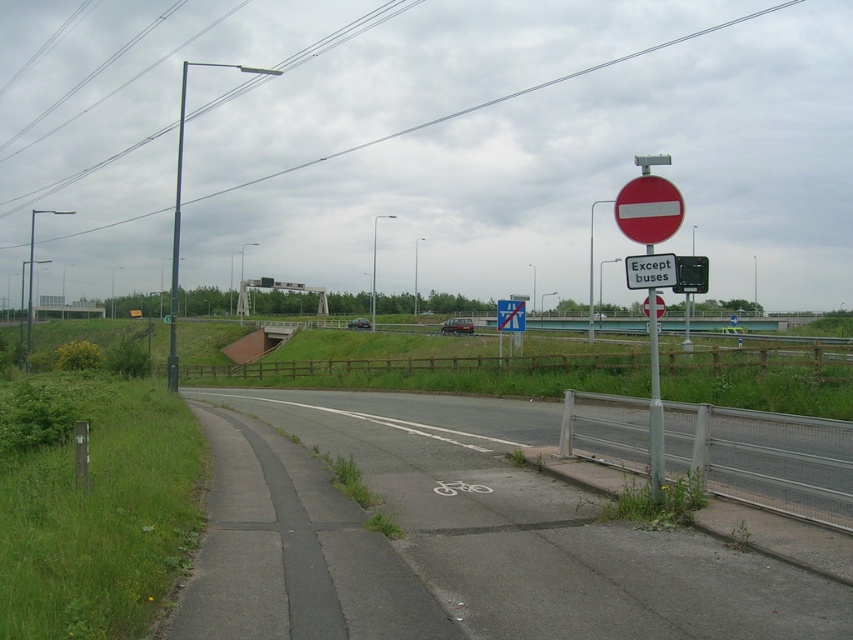
The image size is (853, 640). I want to click on asphalt road at lower left, so click(465, 536).

Which is more to the left, asphalt road at lower left or red matte stop sign at upper right?

From the viewer's perspective, asphalt road at lower left appears more on the left side.

The image size is (853, 640). I want to click on asphalt road at lower left, so click(465, 536).

The height and width of the screenshot is (640, 853). What are the coordinates of `asphalt road at lower left` in the screenshot? It's located at (465, 536).

Is asphalt road at lower left above red matte sign at upper right?

No, asphalt road at lower left is not above red matte sign at upper right.

Can you confirm if asphalt road at lower left is positioned below red matte sign at upper right?

Yes, asphalt road at lower left is below red matte sign at upper right.

Is point (413, 504) positioned before point (619, 218)?

No, it is behind (619, 218).

What are the coordinates of `asphalt road at lower left` in the screenshot? It's located at (465, 536).

Can you confirm if metallic pole at upper right is thinner than red matte stop sign at upper right?

In fact, metallic pole at upper right might be wider than red matte stop sign at upper right.

Who is higher up, metallic pole at upper right or red matte stop sign at upper right?

metallic pole at upper right is higher up.

This screenshot has width=853, height=640. Describe the element at coordinates (654, 406) in the screenshot. I see `metallic pole at upper right` at that location.

Where is `metallic pole at upper right`? metallic pole at upper right is located at coordinates (654, 406).